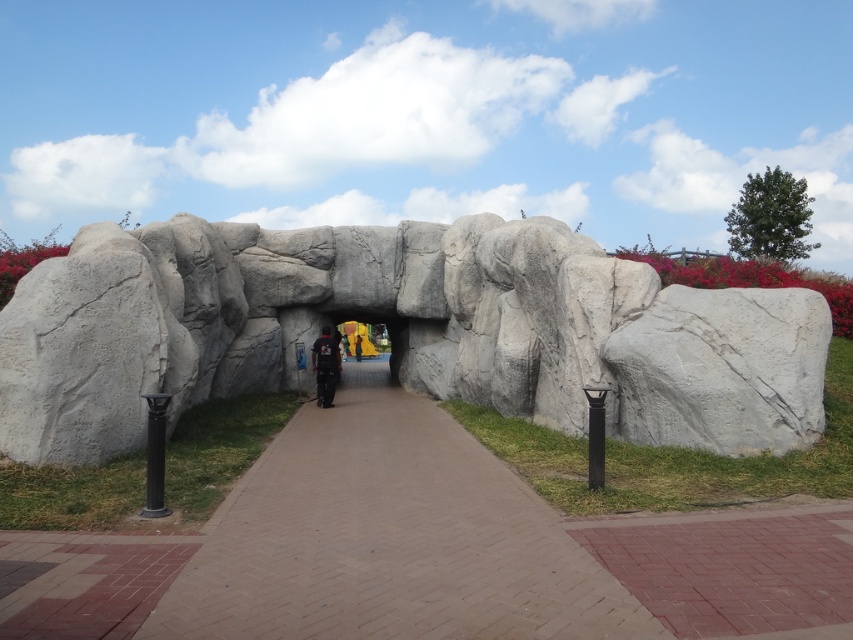
You are a landscape architect designing a garden. You need to place a new statue that is 1.8 meters tall in the garden. The statue must be placed either on the brown brick path at center or near the black matte jacket at center. Based on the scene description, which location would allow the statue to fit without exceeding the height of the existing objects?

The black matte jacket at center is taller than the brown brick path at center. Since the statue is 1.8 meters tall, placing it near the black matte jacket at center would be appropriate as the jacket is taller, providing enough vertical space for the statue.

You are planning to walk through the archway and need to choose between stepping on the brown brick path at center or the black matte jacket at center. Which one is more suitable for walking on?

The brown brick path at center is more suitable for walking on since it has a larger size compared to the black matte jacket at center, making it a more stable and practical surface for walking.

You are designing a garden layout and want to place a 3m wide statue between the white stone archway at center and the brown brick path at center. Can the statue fit through the archway without being wider than the path?

The white stone archway at center might be wider than brown brick path at center. Since the statue is 3m wide, it could potentially fit through the archway if the archway is indeed wider than the path. However, without exact measurements, it is uncertain whether the statue will fit without exceeding the path width.